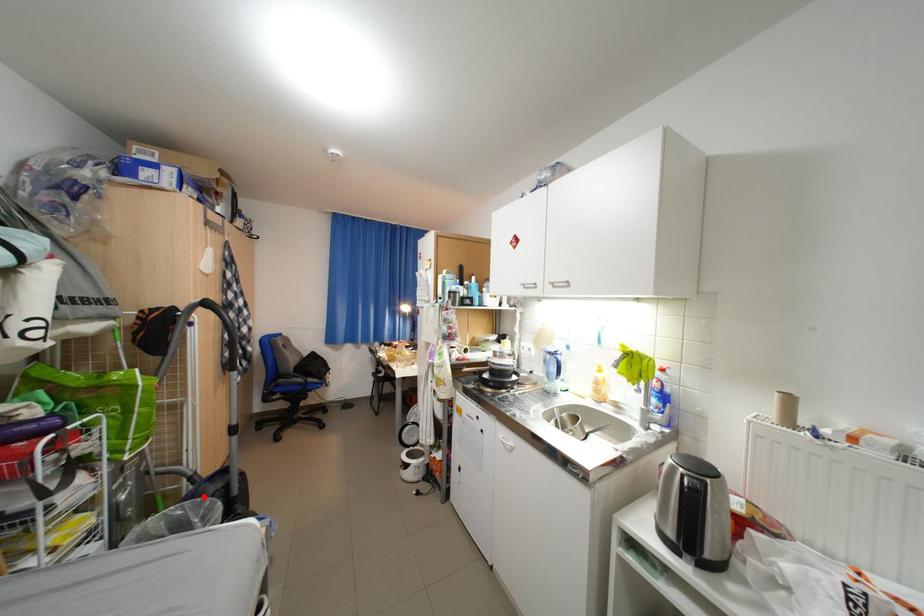
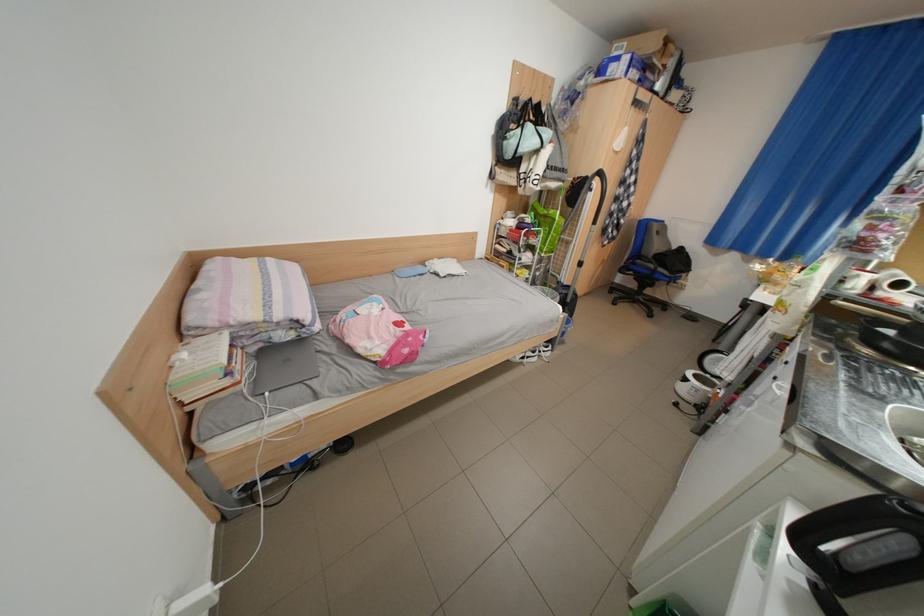
Locate, in the second image, the point that corresponds to the highlighted location in the first image.

(565, 291)